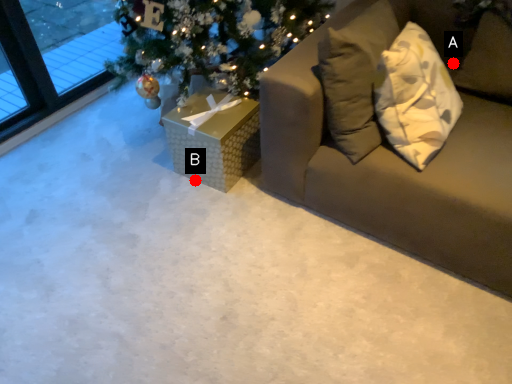
Question: Two points are circled on the image, labeled by A and B beside each circle. Which point is closer to the camera?

Choices:
 (A) A is closer
 (B) B is closer

Answer: (B)